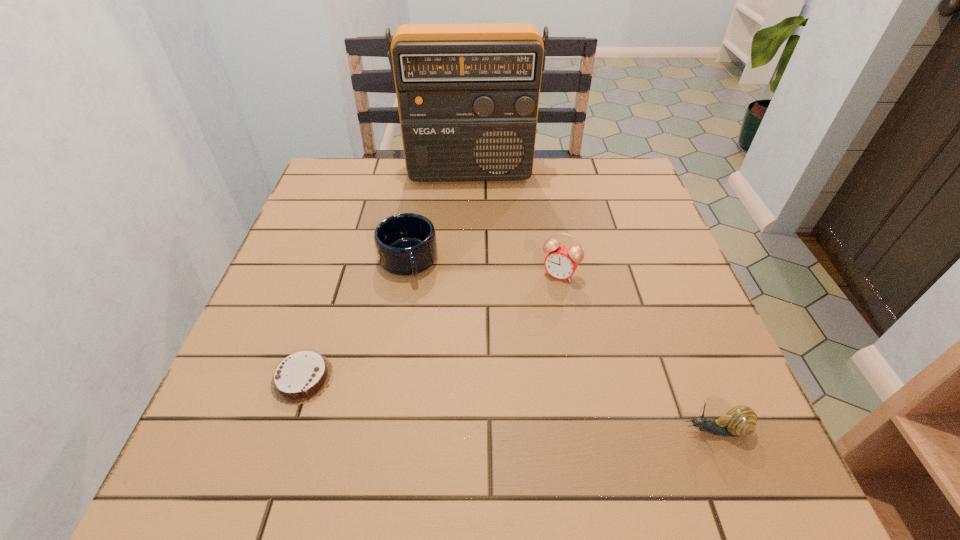
Identify the location of vacant region at the left edge of the desktop. This screenshot has width=960, height=540. (336, 232).

Where is `free space at the far left corner`? free space at the far left corner is located at coordinates (356, 199).

This screenshot has width=960, height=540. In the image, there is a desktop. Find the location of `vacant space at the far right corner`. vacant space at the far right corner is located at coordinates (596, 200).

At what (x,y) coordinates should I click in order to perform the action: click on vacant space at the near right corner of the desktop. Please return your answer as a coordinate pair (x, y). The height and width of the screenshot is (540, 960). Looking at the image, I should click on (682, 429).

At what (x,y) coordinates should I click in order to perform the action: click on unoccupied position between the second tallest object and the rightmost object. Please return your answer as a coordinate pair (x, y). Image resolution: width=960 pixels, height=540 pixels. Looking at the image, I should click on (637, 352).

Where is `unoccupied position between the rightmost object and the mug`? unoccupied position between the rightmost object and the mug is located at coordinates (562, 345).

Where is `vacant area that lies between the third shortest object and the chocolate cake`? vacant area that lies between the third shortest object and the chocolate cake is located at coordinates (355, 319).

This screenshot has height=540, width=960. What are the coordinates of `vacant space that is in between the chocolate cake and the tallest object` in the screenshot? It's located at (386, 275).

Find the location of a particular element. Image resolution: width=960 pixels, height=540 pixels. free space that is in between the tallest object and the rightmost object is located at coordinates (592, 301).

Locate an element on the screen. free space that is in between the nearest object and the mug is located at coordinates (562, 345).